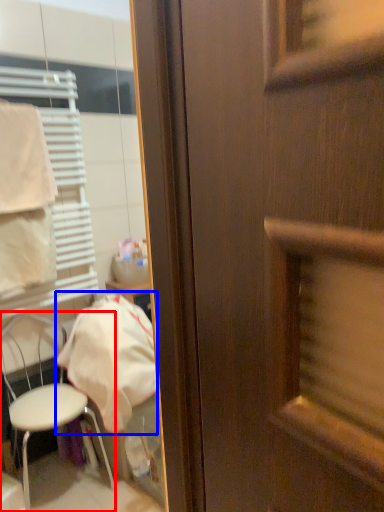
Question: Which object is further to the camera taking this photo, chair (highlighted by a red box) or cloth (highlighted by a blue box)?

Choices:
 (A) chair
 (B) cloth

Answer: (B)